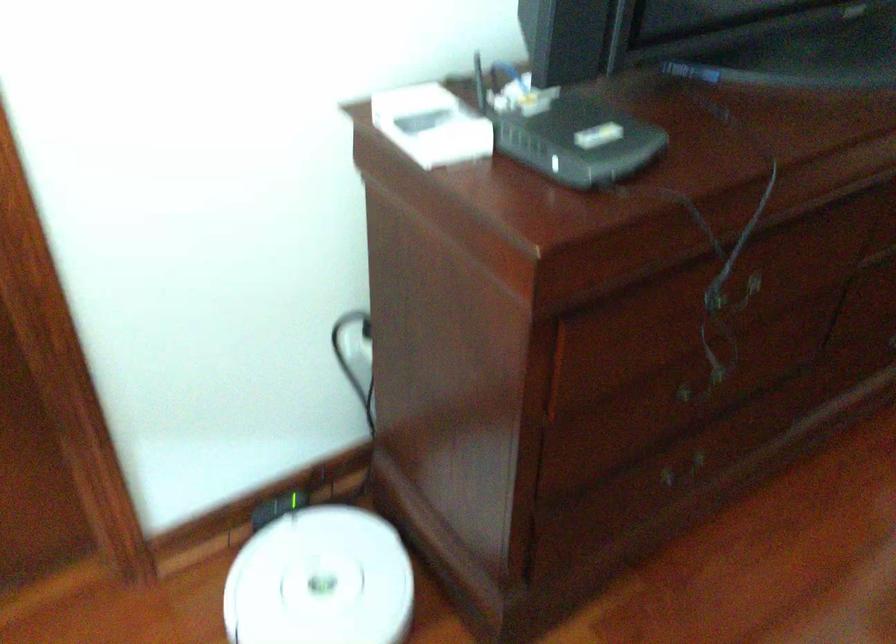
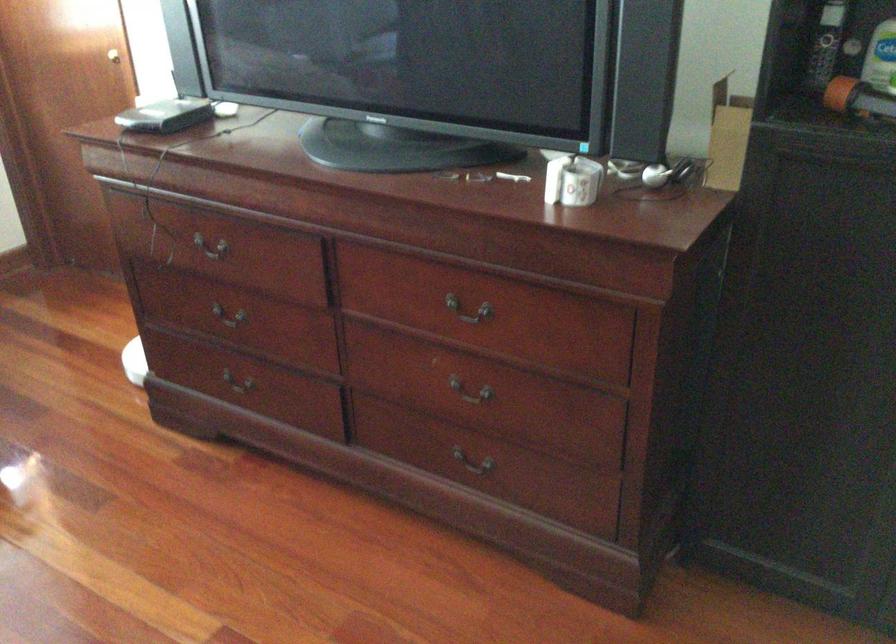
Find the pixel in the second image that matches (x=533, y=126) in the first image.

(165, 116)